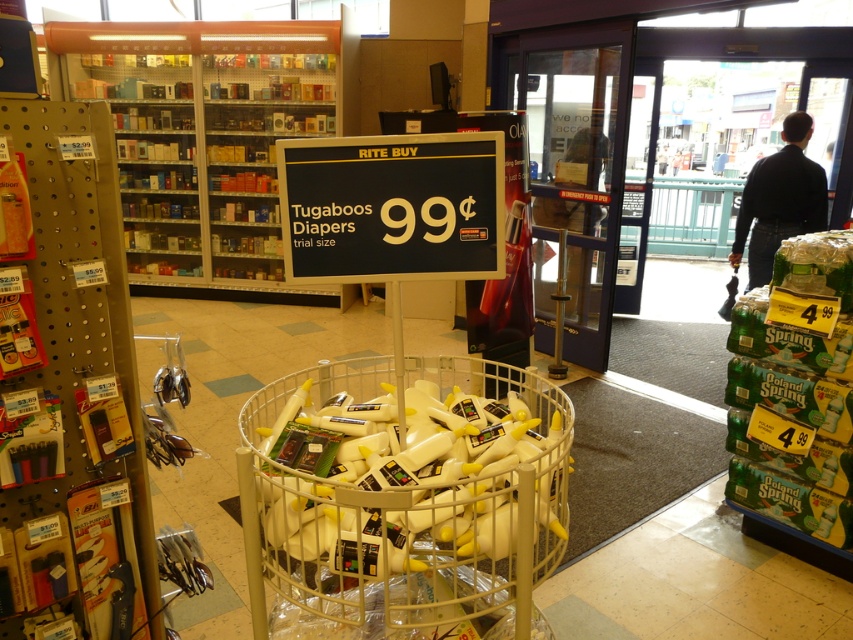
Is the position of metallic silver shelves at upper left more distant than that of black plastic sign at center?

Yes, metallic silver shelves at upper left is further from the viewer.

Which of these two, metallic silver shelves at upper left or black plastic sign at center, stands shorter?

black plastic sign at center is shorter.

Is point (338, 54) behind point (419, 237)?

Yes, it is.

The image size is (853, 640). Find the location of `metallic silver shelves at upper left`. metallic silver shelves at upper left is located at coordinates (204, 141).